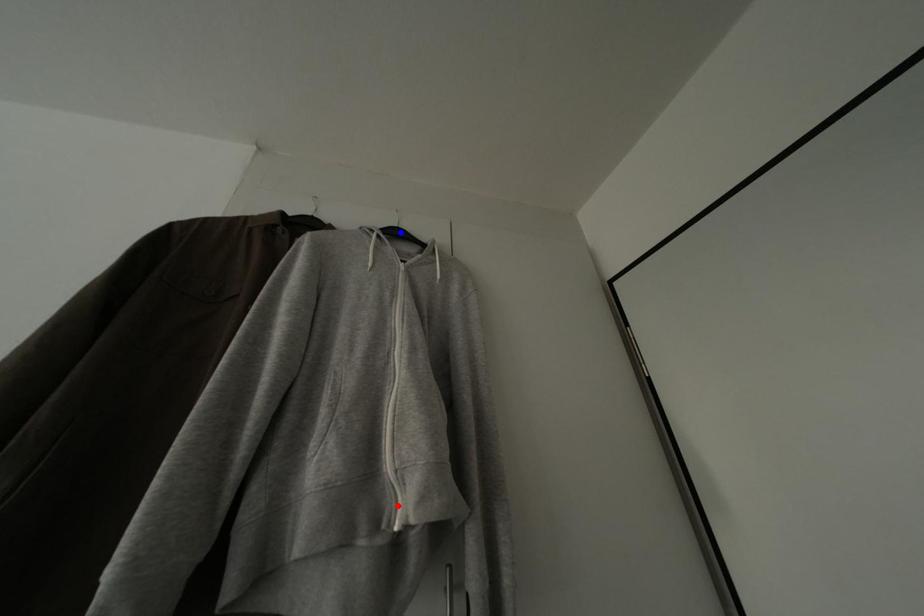
Question: Two points are marked on the image. Which point is closer to the camera?

Choices:
 (A) Blue point is closer.
 (B) Red point is closer.

Answer: (B)